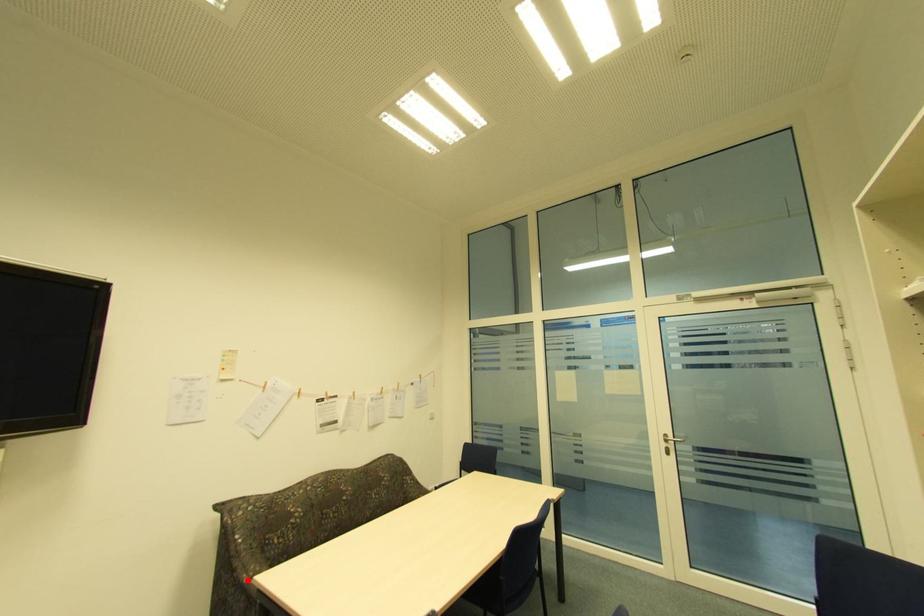
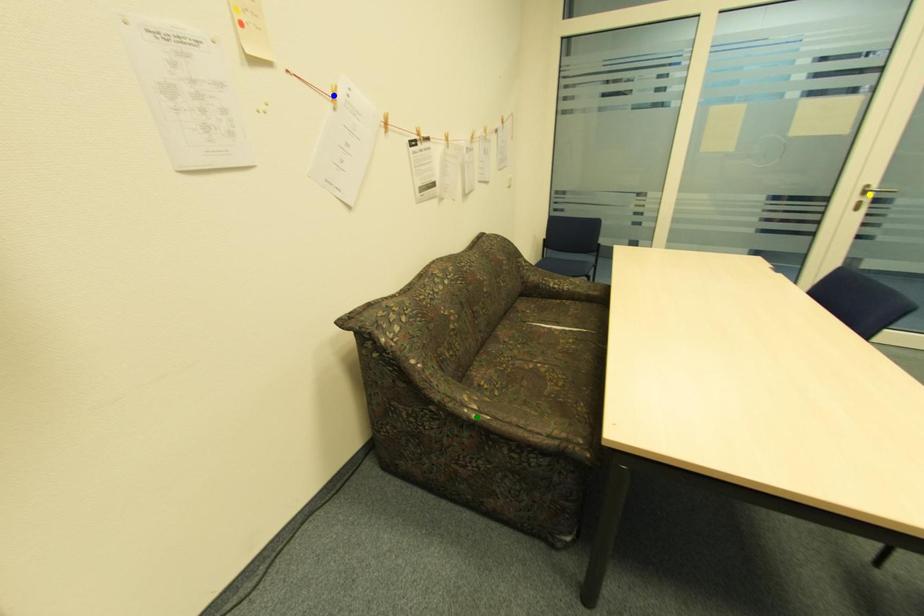
Question: I am providing you with two images of the same scene from different viewpoints. A red point is marked on the first image. You are given multiple points on the second image. Which mark in image 2 goes with the point in image 1?

Choices:
 (A) blue point
 (B) green point
 (C) yellow point

Answer: (B)